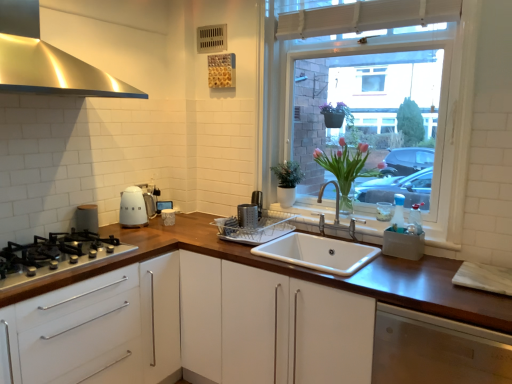
Question: Looking at their shapes, would you say white ceramic sink at center is wider or thinner than dark brown wood at lower right, the 2th cabinetry when ordered from left to right?

Choices:
 (A) thin
 (B) wide

Answer: (A)

Question: In the image, is white ceramic sink at center on the left side or the right side of dark brown wood at lower right, the 2th cabinetry when ordered from left to right?

Choices:
 (A) right
 (B) left

Answer: (B)

Question: Which is farther from the stainless steel range hood at upper left?

Choices:
 (A) wooden at center
 (B) white ceramic sink at center
 (C) pink glass vase at center
 (D) white glass window at upper right
 (E) matte black gas stove at lower left

Answer: (C)

Question: Which of these objects is positioned closest to the stainless steel range hood at upper left?

Choices:
 (A) white glossy cabinet at lower left, which is the second cabinetry from right to left
 (B) silver metallic grater at center, the third appliance in the left-to-right sequence
 (C) matte white kettle at left, the second appliance from the left
 (D) white ceramic sink at center
 (E) pink glass vase at center

Answer: (C)